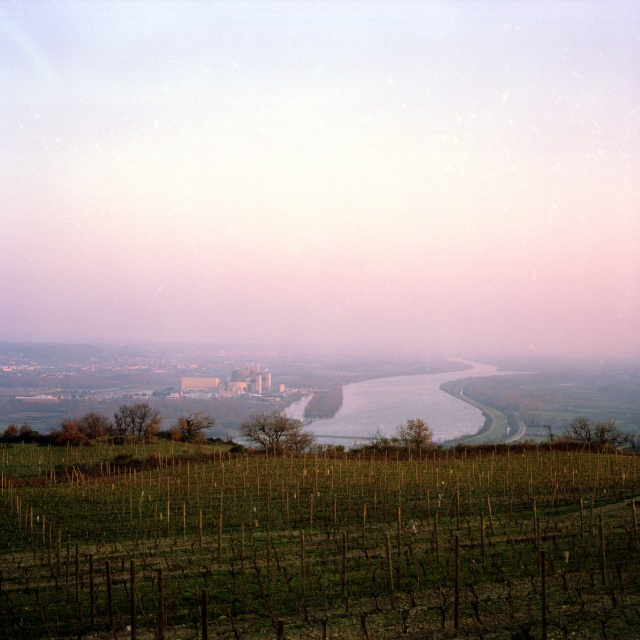
Question: Is green grassy vineyard at lower center smaller than gray/smooth river at center?

Choices:
 (A) yes
 (B) no

Answer: (B)

Question: Which point is closer to the camera taking this photo?

Choices:
 (A) (380, 380)
 (B) (116, 502)

Answer: (B)

Question: Which point is closer to the camera taking this photo?

Choices:
 (A) (61, 589)
 (B) (481, 374)

Answer: (A)

Question: Is green grassy vineyard at lower center wider than gray/smooth river at center?

Choices:
 (A) yes
 (B) no

Answer: (A)

Question: Is green grassy vineyard at lower center to the right of gray/smooth river at center from the viewer's perspective?

Choices:
 (A) yes
 (B) no

Answer: (B)

Question: Which of the following is the farthest from the observer?

Choices:
 (A) green grassy vineyard at lower center
 (B) gray/smooth river at center

Answer: (B)